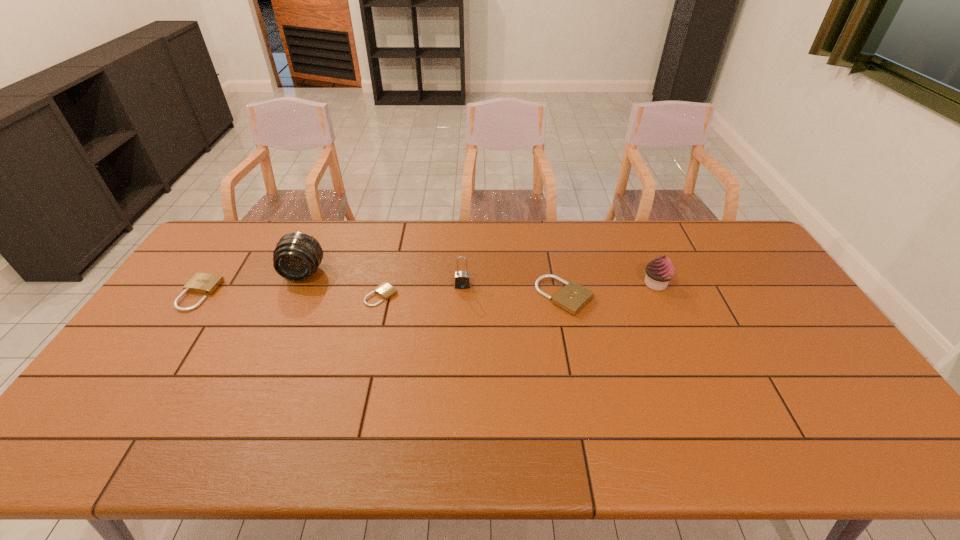
I want to click on object that ranks as the fifth closest to the third object from left to right, so click(659, 272).

What are the coordinates of `object that stands as the second closest to the rightmost padlock` in the screenshot? It's located at (462, 280).

You are a GUI agent. You are given a task and a screenshot of the screen. Output one action in this format:
    pyautogui.click(x=<x>, y=<y>)
    Task: Click on the padlock that is the closest one to the second shortest object
    
    Given the screenshot: What is the action you would take?
    pyautogui.click(x=385, y=290)

I want to click on padlock that is the closest one to the rightmost padlock, so click(x=462, y=280).

Identify the location of free location that satisfies the following two spatial constraints: 1. at the front element of the fifth object from right to left; 2. on the left side of the rightmost object. tap(299, 284).

This screenshot has width=960, height=540. What are the coordinates of `free location that satisfies the following two spatial constraints: 1. on the back side of the cupcake; 2. on the left side of the second object from right to left` in the screenshot? It's located at (562, 284).

This screenshot has height=540, width=960. I want to click on free location that satisfies the following two spatial constraints: 1. at the front element of the tallest object; 2. on the right side of the shortest object, so click(294, 295).

Where is `vacant space that satisfies the following two spatial constraints: 1. on the front side of the leftmost object; 2. on the right side of the rightmost padlock`? The height and width of the screenshot is (540, 960). vacant space that satisfies the following two spatial constraints: 1. on the front side of the leftmost object; 2. on the right side of the rightmost padlock is located at coordinates (199, 296).